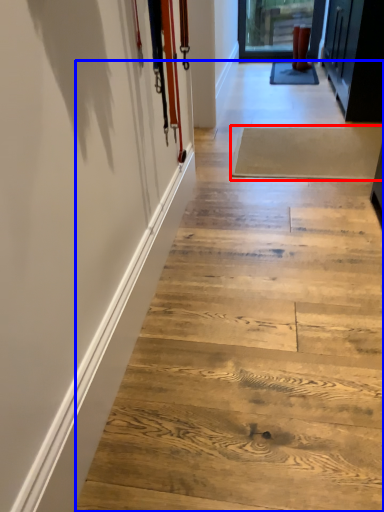
Question: Among these objects, which one is farthest to the camera, plank (highlighted by a red box) or stair (highlighted by a blue box)?

Choices:
 (A) plank
 (B) stair

Answer: (A)